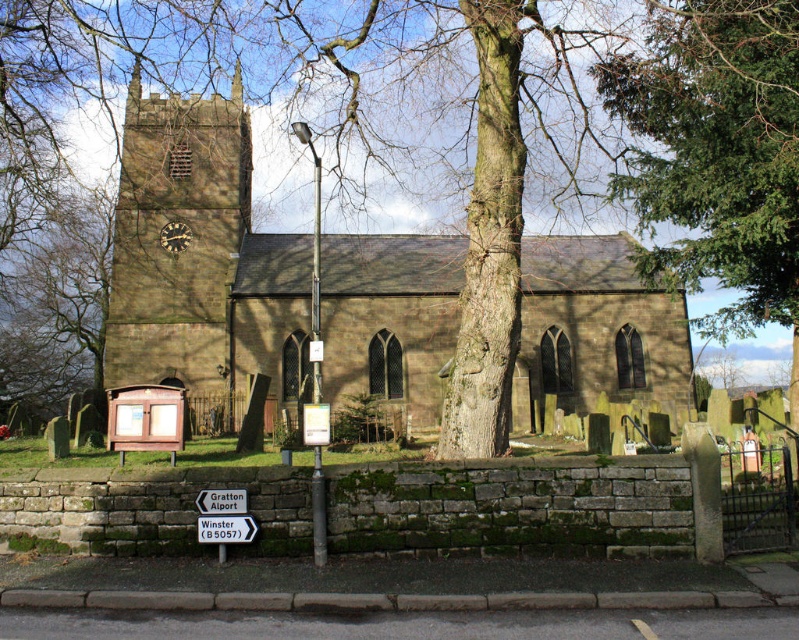
Question: Among these objects, which one is nearest to the camera?

Choices:
 (A) brown stone clock tower at center-left
 (B) white plastic sign at lower center

Answer: (B)

Question: Which object appears closest to the camera in this image?

Choices:
 (A) brown stone church at center
 (B) white plastic sign at lower center
 (C) wooden clock at center-left
 (D) brown stone clock tower at center-left

Answer: (B)

Question: Is the position of green coniferous tree at upper right more distant than that of white plastic sign at lower center?

Choices:
 (A) yes
 (B) no

Answer: (A)

Question: Is brown stone church at center bigger than wooden clock at center-left?

Choices:
 (A) no
 (B) yes

Answer: (B)

Question: Is brown stone church at center closer to the viewer compared to green coniferous tree at upper right?

Choices:
 (A) no
 (B) yes

Answer: (B)

Question: Which point is closer to the camera?

Choices:
 (A) wooden clock at center-left
 (B) brown stone clock tower at center-left
 (C) brown stone church at center

Answer: (C)